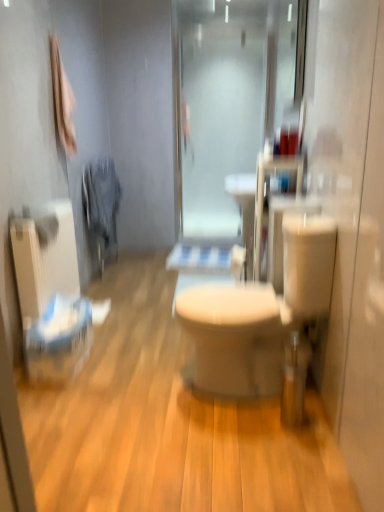
Question: Relative to white matte toilet paper at center, is white glossy toilet at center in front or behind?

Choices:
 (A) behind
 (B) front

Answer: (B)

Question: Would you say white glossy toilet at center is inside or outside white matte toilet paper at center?

Choices:
 (A) inside
 (B) outside

Answer: (B)

Question: Estimate the real-world distances between objects in this image. Which object is closer to the white glossy toilet at center?

Choices:
 (A) white matte toilet paper at center
 (B) frosted glass shower door at center
 (C) white textured radiator at left
 (D) white plastic laundry basket at lower left
 (E) beige matte toilet at center

Answer: (D)

Question: Considering the real-world distances, which object is farthest from the frosted glass shower door at center?

Choices:
 (A) white textured radiator at left
 (B) beige matte toilet at center
 (C) white glossy toilet at center
 (D) white plastic laundry basket at lower left
 (E) white matte toilet paper at center

Answer: (B)